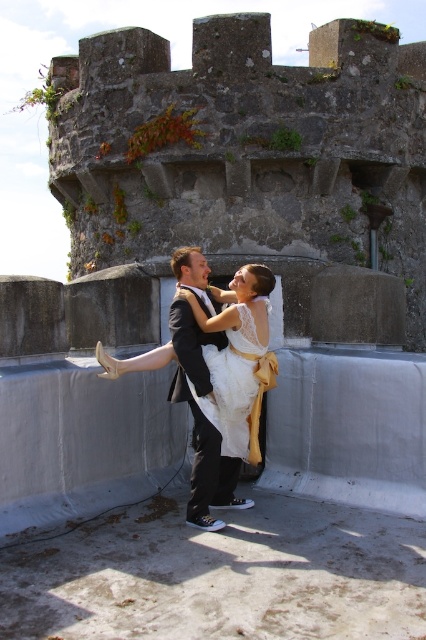
Is white satin dress at center in front of white lace dress at center?

Yes, it is in front of white lace dress at center.

Can you confirm if white satin dress at center is taller than white lace dress at center?

Indeed, white satin dress at center has a greater height compared to white lace dress at center.

Who is more forward, (195,324) or (241,444)?

Positioned in front is point (195,324).

Identify the location of white satin dress at center. The height and width of the screenshot is (640, 426). (215, 374).